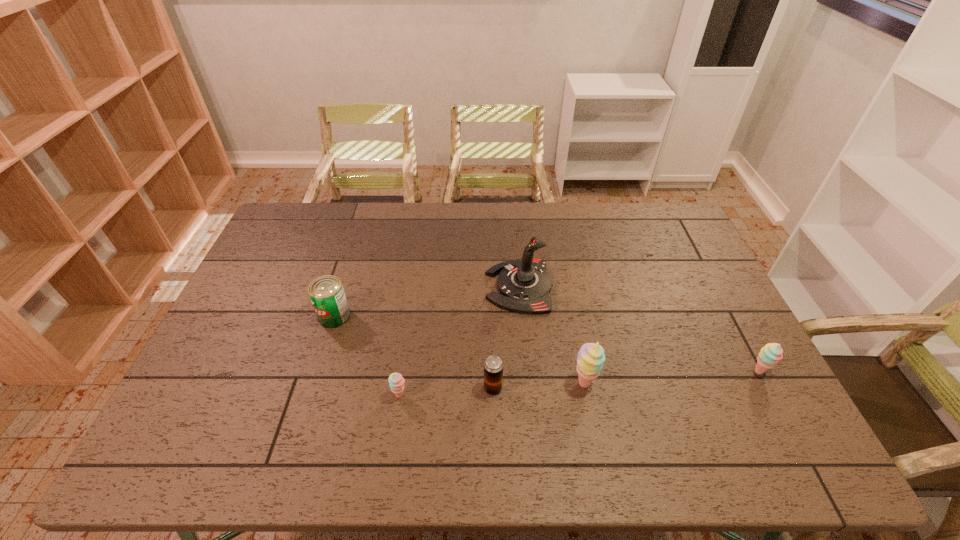
Locate an element on the screen. vacant space at the near edge of the desktop is located at coordinates (542, 404).

Image resolution: width=960 pixels, height=540 pixels. I want to click on free region at the left edge of the desktop, so click(x=191, y=382).

Find the location of a particular element. This screenshot has height=540, width=960. vacant space at the right edge is located at coordinates (730, 339).

In the image, there is a desktop. Identify the location of free space at the far left corner. Image resolution: width=960 pixels, height=540 pixels. (300, 219).

Where is `vacant space at the near left corner of the desktop`? The width and height of the screenshot is (960, 540). vacant space at the near left corner of the desktop is located at coordinates (237, 390).

Where is `free space at the near right corner of the desktop`? Image resolution: width=960 pixels, height=540 pixels. free space at the near right corner of the desktop is located at coordinates (761, 394).

This screenshot has height=540, width=960. I want to click on vacant space that is in between the second tallest sherbert and the joystick, so click(x=639, y=329).

I want to click on unoccupied position between the fifth object from right to left and the beer can, so click(x=446, y=392).

Find the location of a particular element. This screenshot has width=960, height=540. vacant area that lies between the can and the fifth object from left to right is located at coordinates (459, 349).

Locate an element on the screen. The image size is (960, 540). unoccupied area between the second tallest sherbert and the second sherbert from right to left is located at coordinates (671, 377).